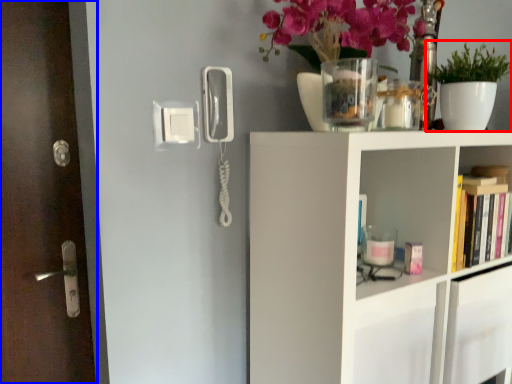
Question: Which of the following is the closest to the observer, houseplant (highlighted by a red box) or door (highlighted by a blue box)?

Choices:
 (A) houseplant
 (B) door

Answer: (B)